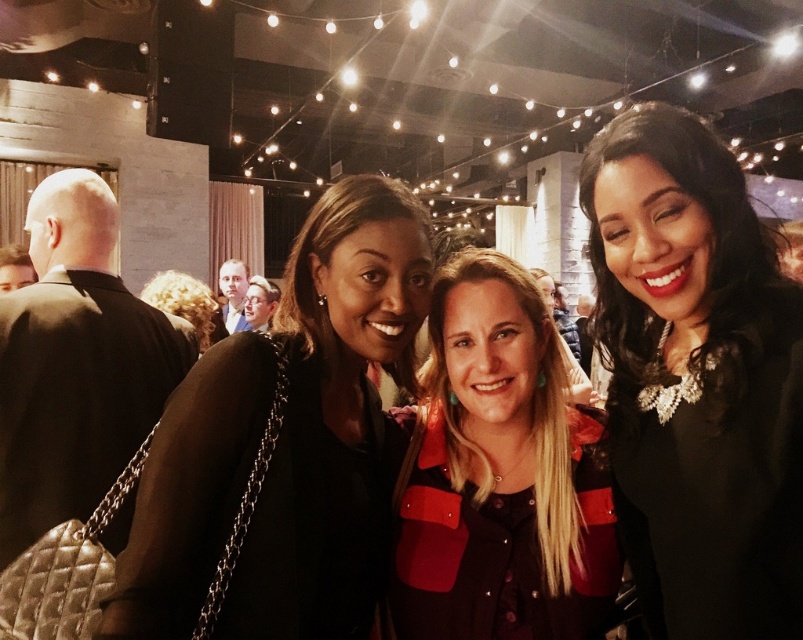
Question: Can you confirm if black shiny necklace at upper right is positioned to the right of matte black jacket at left?

Choices:
 (A) no
 (B) yes

Answer: (B)

Question: Is black shiny necklace at upper right behind matte black jacket at left?

Choices:
 (A) no
 (B) yes

Answer: (B)

Question: Which point is closer to the camera taking this photo?

Choices:
 (A) (353, 637)
 (B) (634, 243)

Answer: (B)

Question: Which object appears farthest from the camera in this image?

Choices:
 (A) matte black jacket at left
 (B) black shiny necklace at upper right

Answer: (B)

Question: Which is farther from the black shiny necklace at upper right?

Choices:
 (A) matte black jacket at center
 (B) matte black jacket at left

Answer: (B)

Question: Does black shiny necklace at upper right have a smaller size compared to matte black jacket at left?

Choices:
 (A) yes
 (B) no

Answer: (A)